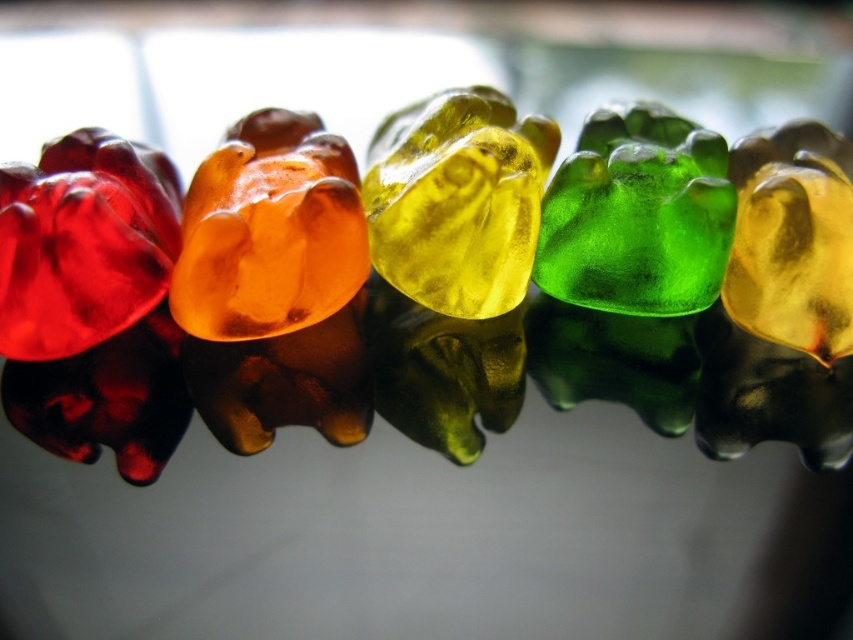
Can you confirm if translucent yellow jelly bear at center is positioned above green translucent gummy bear at center?

Indeed, translucent yellow jelly bear at center is positioned over green translucent gummy bear at center.

Which is in front, point (540, 132) or point (645, 298)?

Positioned in front is point (645, 298).

I want to click on translucent yellow jelly bear at center, so click(457, 200).